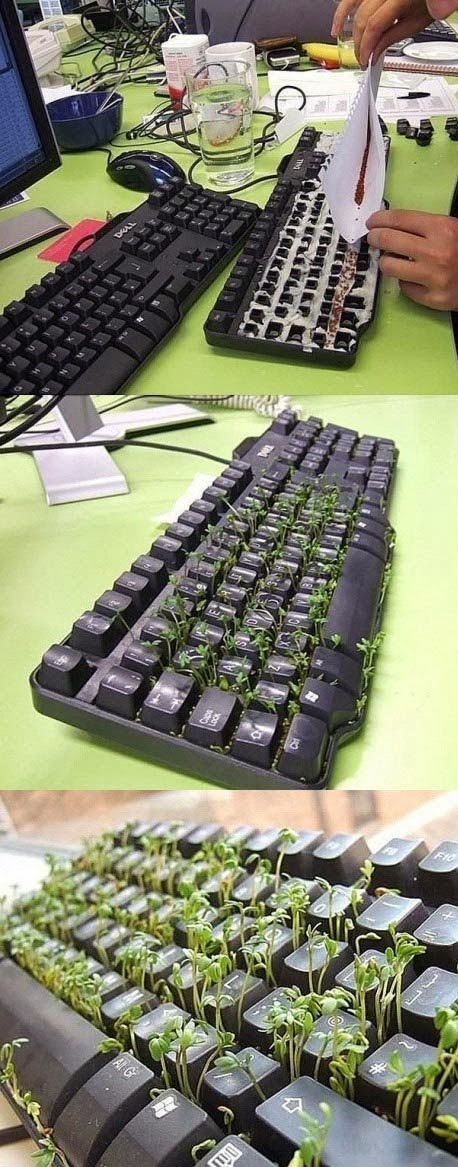
Find the location of a particular element. bowl is located at coordinates (77, 121).